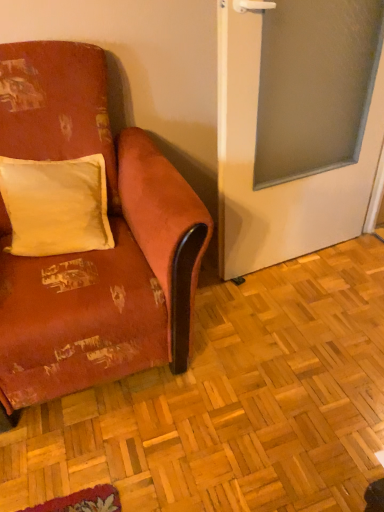
Locate an element on the screen. The height and width of the screenshot is (512, 384). free location in front of frosted glass screen door at right is located at coordinates (305, 323).